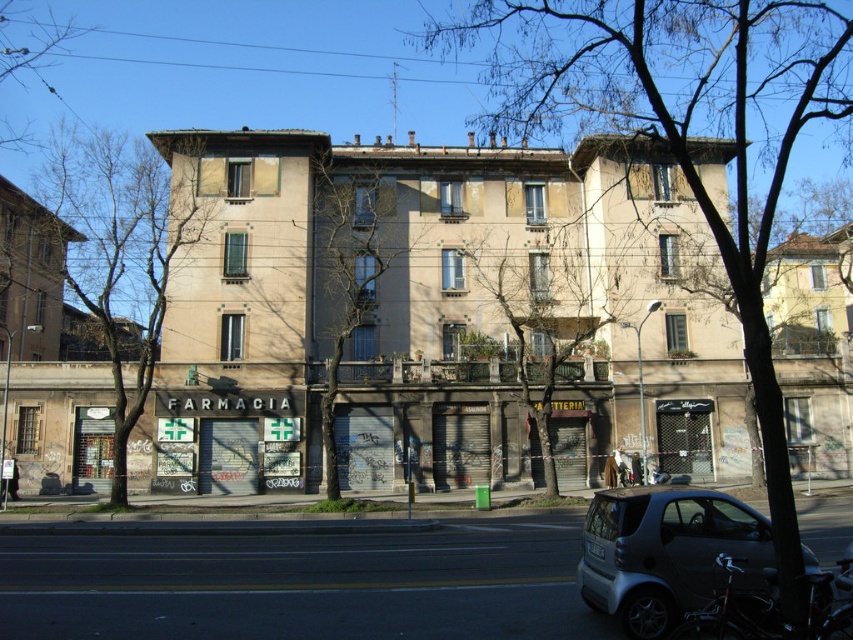
Question: Estimate the real-world distances between objects in this image. Which object is farther from the bare branches at center?

Choices:
 (A) brown textured tree at left
 (B) brown textured tree at upper center

Answer: (A)

Question: Estimate the real-world distances between objects in this image. Which object is farther from the bare branches at center?

Choices:
 (A) silver metallic car at lower right
 (B) green leafless tree at center
 (C) brown textured tree at upper left
 (D) brown textured tree at left

Answer: (C)

Question: Observing the image, what is the correct spatial positioning of brown textured tree at left in reference to brown textured tree at upper left?

Choices:
 (A) below
 (B) above

Answer: (A)

Question: Can you confirm if silver metallic car at lower right is bigger than shiny black bicycle at lower right?

Choices:
 (A) no
 (B) yes

Answer: (A)

Question: Based on their relative distances, which object is nearer to the shiny black bicycle at lower right?

Choices:
 (A) silver metallic car at lower right
 (B) green leafless tree at center
 (C) bare branches at center
 (D) brown textured tree at upper left

Answer: (A)

Question: Observing the image, what is the correct spatial positioning of brown textured tree at left in reference to silver metallic car at lower right?

Choices:
 (A) right
 (B) left

Answer: (B)